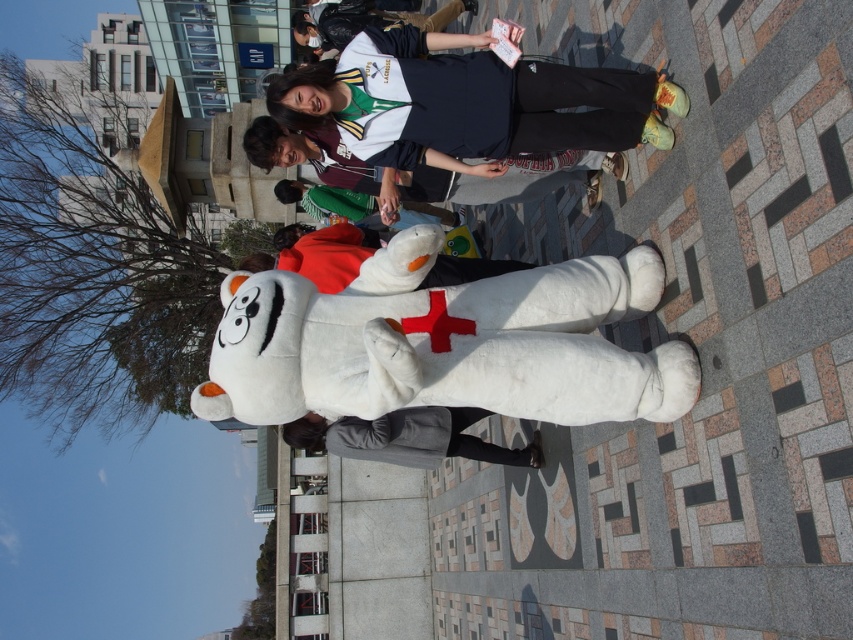
Question: Can you confirm if matte white jacket at center is wider than gray fleece jacket at lower center?

Choices:
 (A) yes
 (B) no

Answer: (A)

Question: Which object is farther from the camera taking this photo?

Choices:
 (A) matte white jacket at center
 (B) gray fleece jacket at lower center

Answer: (B)

Question: Does white plush bear at center appear under matte white jacket at center?

Choices:
 (A) yes
 (B) no

Answer: (A)

Question: Does white plush bear at center have a greater width compared to gray fleece jacket at lower center?

Choices:
 (A) yes
 (B) no

Answer: (B)

Question: Which point appears closest to the camera in this image?

Choices:
 (A) (251, 160)
 (B) (575, 400)
 (C) (503, 458)

Answer: (B)

Question: Considering the real-world distances, which object is farthest from the gray fleece jacket at lower center?

Choices:
 (A) white plush bear at center
 (B) matte white jacket at center

Answer: (A)